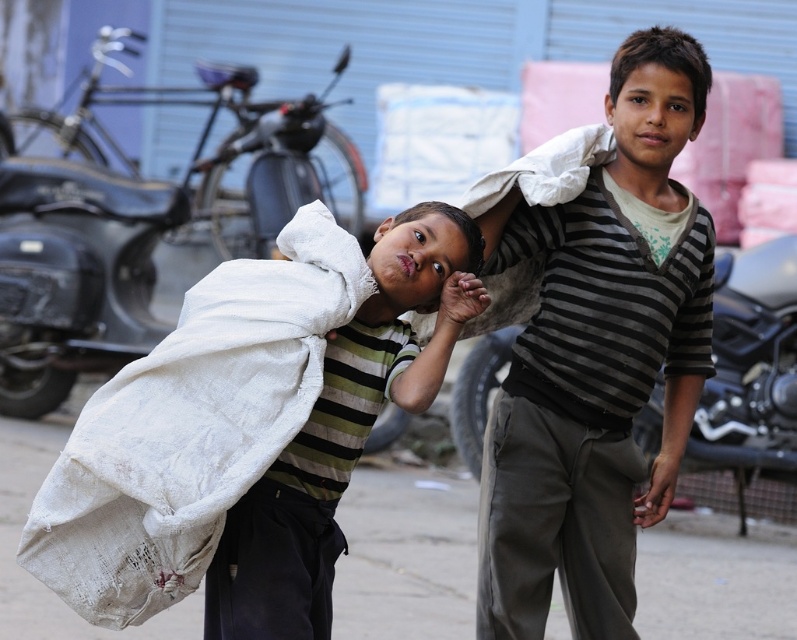
Is black matte motorcycle at center thinner than white fabric sack at center?

No.

Measure the distance between black matte motorcycle at center and white fabric sack at center.

They are 8.88 meters apart.

Is point (134, 348) positioned before point (415, 220)?

That is False.

Where is `black matte motorcycle at center`? Image resolution: width=797 pixels, height=640 pixels. black matte motorcycle at center is located at coordinates (140, 220).

Is white fabric bag at center above black matte motorcycle at center?

No, white fabric bag at center is not above black matte motorcycle at center.

Which is behind, point (642, 348) or point (328, 90)?

Positioned behind is point (328, 90).

Is point (662, 227) positioned behind point (244, 188)?

No.

Image resolution: width=797 pixels, height=640 pixels. What are the coordinates of `white fabric bag at center` in the screenshot? It's located at (599, 360).

Who is lower down, white fabric bag at center or white woven sack at center?

white woven sack at center is lower down.

Identify the location of white fabric bag at center. (599, 360).